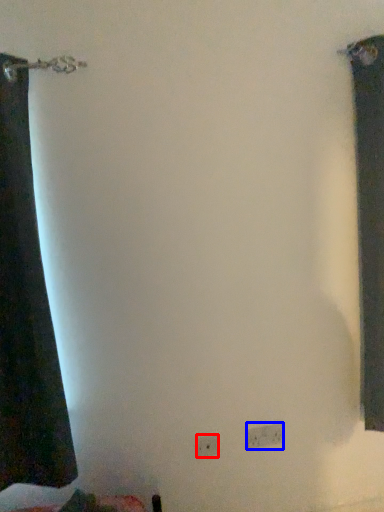
Question: Which object appears closest to the camera in this image, electric outlet (highlighted by a red box) or electric outlet (highlighted by a blue box)?

Choices:
 (A) electric outlet
 (B) electric outlet

Answer: (A)